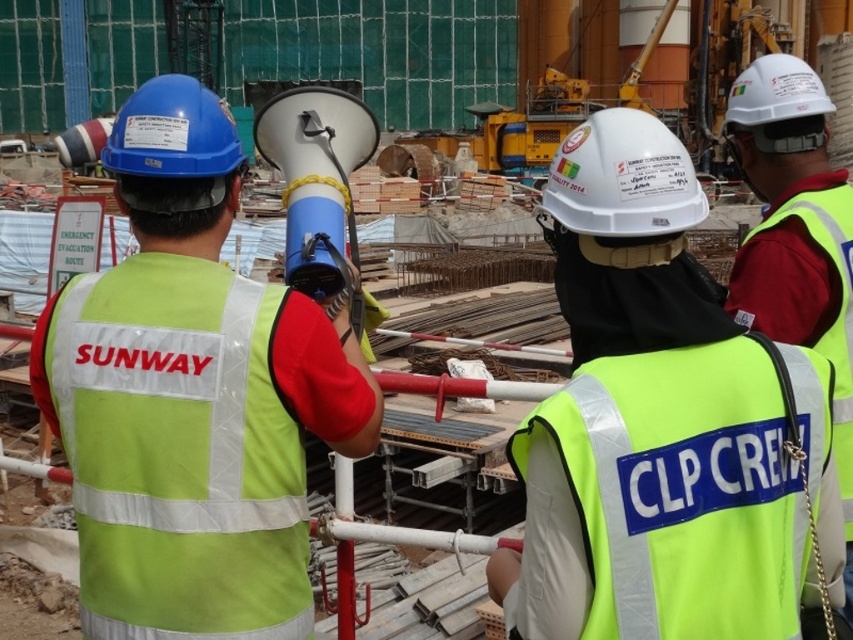
Question: Which point is farther to the camera?

Choices:
 (A) (772, 221)
 (B) (746, 513)

Answer: (A)

Question: Does high visibility vest at center have a smaller size compared to yellow reflective safety vest at center?

Choices:
 (A) no
 (B) yes

Answer: (A)

Question: Based on their relative distances, which object is farther from the high visibility vest at center?

Choices:
 (A) yellow reflective vest at center
 (B) yellow reflective safety vest at center

Answer: (B)

Question: Is high visibility vest at center positioned before yellow reflective safety vest at center?

Choices:
 (A) yes
 (B) no

Answer: (B)

Question: Is yellow reflective vest at center positioned before yellow reflective safety vest at center?

Choices:
 (A) no
 (B) yes

Answer: (B)

Question: Which point is closer to the camera?

Choices:
 (A) yellow reflective vest at center
 (B) high visibility vest at center
 (C) yellow reflective safety vest at center

Answer: (A)